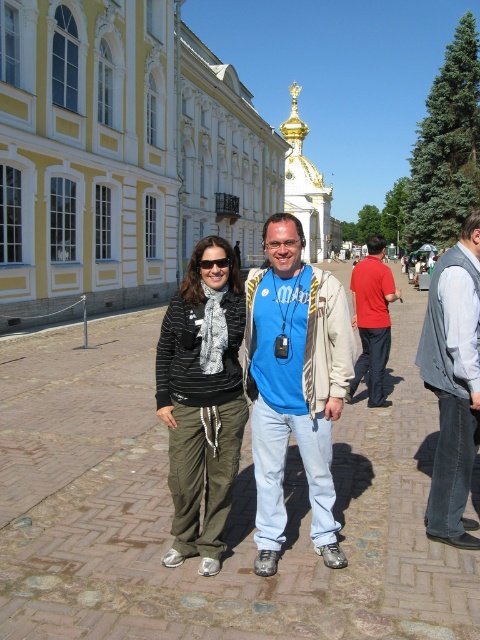
You are a photographer planning to take a group photo of the two people in the scene. You want to ensure both the striped fabric scarf at center and the red cotton shirt at center are clearly visible. Which item might you need to adjust to ensure it doesn

The striped fabric scarf at center is smaller than the red cotton shirt at center, so you might need to adjust the angle or position to ensure the smaller scarf is visible alongside the larger shirt.

Based on the photo, you are a photographer planning to take a group photo of the striped fabric scarf at center and the red cotton shirt at center. The minimum distance required for your camera to focus properly is 40 feet. Based on the scene, will your camera be able to focus on both subjects simultaneously?

The distance between the striped fabric scarf at center and the red cotton shirt at center is 44.34 feet, which exceeds the minimum required 40 feet. Therefore, the camera should be able to focus on both subjects simultaneously.

You are a tailor measuring fabrics for a custom order. You have a blue fabric shirt at center and a gray fabric vest at right. Which fabric piece is taller?

The blue fabric shirt at center is much taller than the gray fabric vest at right.